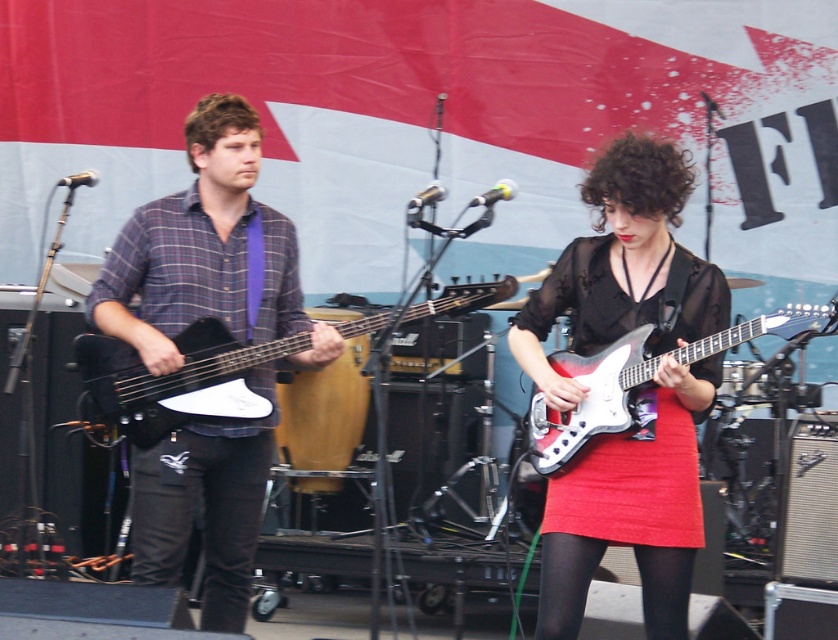
You are a photographer at the live music performance. You want to take a photo of the shiny black dress at center and the matte plaid shirt at center. Which one will appear larger in the photo?

→ The shiny black dress at center will appear larger in the photo because it is closer to the viewer than the matte plaid shirt at center.

You are a photographer at the event and want to capture a closeup of the shiny black dress at center and the black denim pants at left. Which one is wider in the image?

The shiny black dress at center is wider than the black denim pants at left according to the description.

You are a photographer at the live music performance. You need to capture a photo that includes both the matte plaid shirt at center and the black denim pants at left. Which object should you focus on first to ensure both are in frame?

The matte plaid shirt at center is taller than the black denim pants at left, so you should focus on the matte plaid shirt at center first to ensure both are in frame.